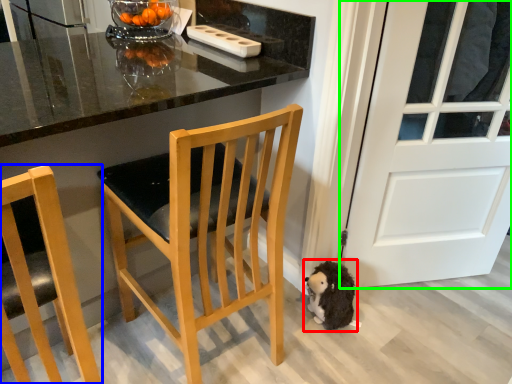
Question: Considering the real-world distances, which object is farthest from animal (highlighted by a red box)? chair (highlighted by a blue box) or door (highlighted by a green box)?

Choices:
 (A) chair
 (B) door

Answer: (A)